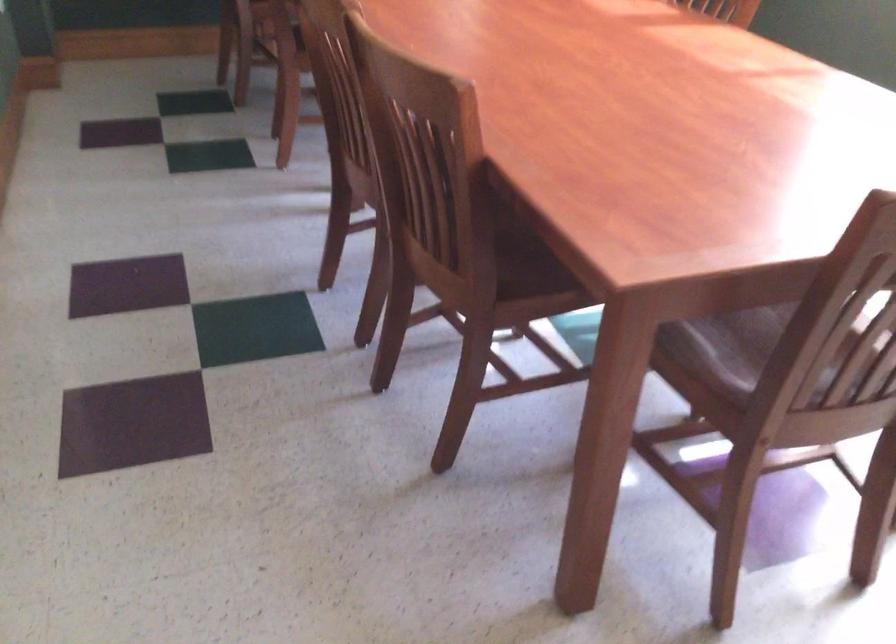
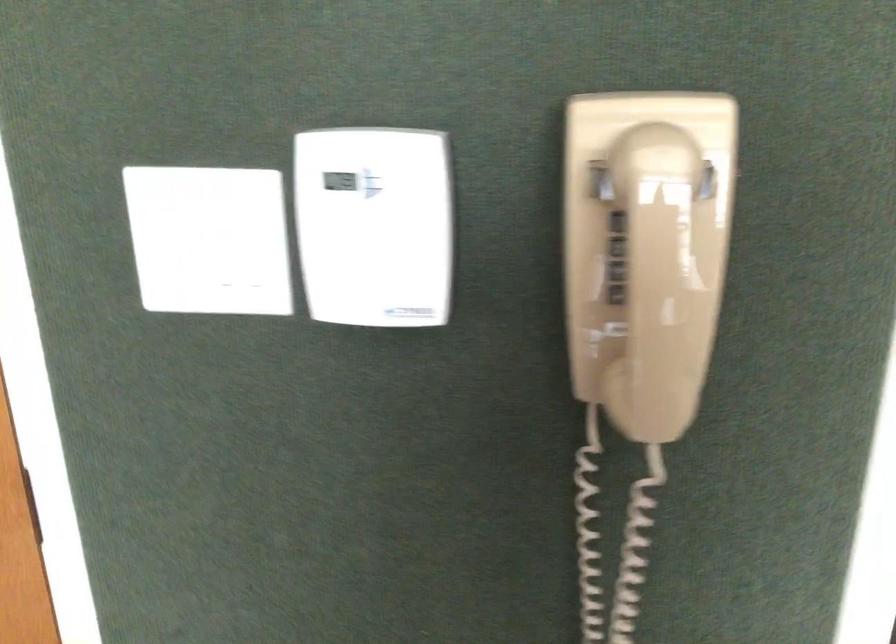
Based on the continuous images, in which direction is the camera rotating?

The camera rotated toward left-down.